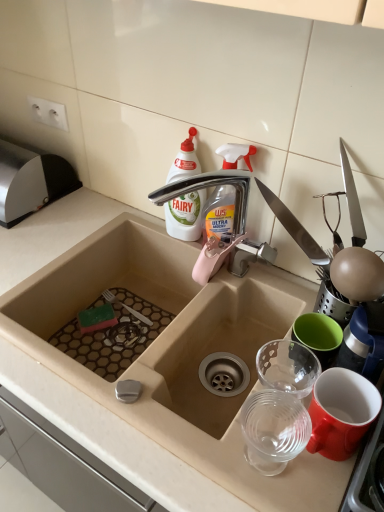
Question: Is transparent plastic cups at right thinner than white plastic bottle at upper center?

Choices:
 (A) yes
 (B) no

Answer: (B)

Question: Is transparent plastic cups at right located outside white plastic bottle at upper center?

Choices:
 (A) no
 (B) yes

Answer: (B)

Question: Does transparent plastic cups at right have a greater height compared to white plastic bottle at upper center?

Choices:
 (A) yes
 (B) no

Answer: (B)

Question: Can you see transparent plastic cups at right touching white plastic bottle at upper center?

Choices:
 (A) yes
 (B) no

Answer: (B)

Question: Is transparent plastic cups at right positioned behind white plastic bottle at upper center?

Choices:
 (A) yes
 (B) no

Answer: (B)

Question: Does transparent plastic cups at right have a larger size compared to white plastic bottle at upper center?

Choices:
 (A) no
 (B) yes

Answer: (A)

Question: From the image's perspective, is transparent plastic cups at right over silver metallic tap at upper center?

Choices:
 (A) yes
 (B) no

Answer: (B)

Question: Considering the relative sizes of transparent plastic cups at right and silver metallic tap at upper center in the image provided, is transparent plastic cups at right thinner than silver metallic tap at upper center?

Choices:
 (A) no
 (B) yes

Answer: (B)

Question: Is transparent plastic cups at right outside silver metallic tap at upper center?

Choices:
 (A) yes
 (B) no

Answer: (A)

Question: From the image's perspective, is transparent plastic cups at right beneath silver metallic tap at upper center?

Choices:
 (A) yes
 (B) no

Answer: (A)

Question: Is silver metallic tap at upper center at the back of transparent plastic cups at right?

Choices:
 (A) yes
 (B) no

Answer: (B)

Question: Is transparent plastic cups at right at the right side of silver metallic tap at upper center?

Choices:
 (A) no
 (B) yes

Answer: (B)

Question: Could you tell me if white plastic bottle at upper center is turned towards silver metallic tap at upper center?

Choices:
 (A) yes
 (B) no

Answer: (B)